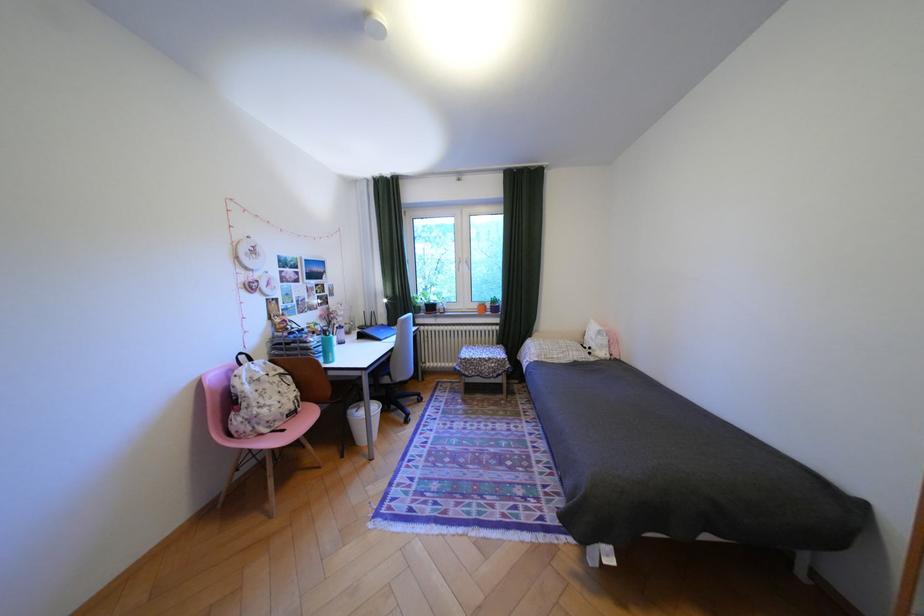
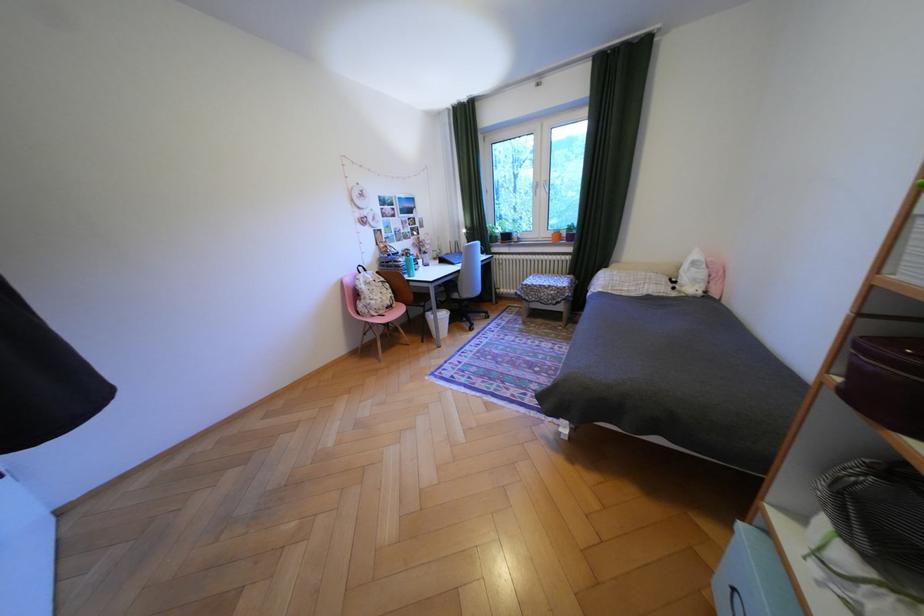
The point at (602, 349) is marked in the first image. Where is the corresponding point in the second image?

(687, 282)